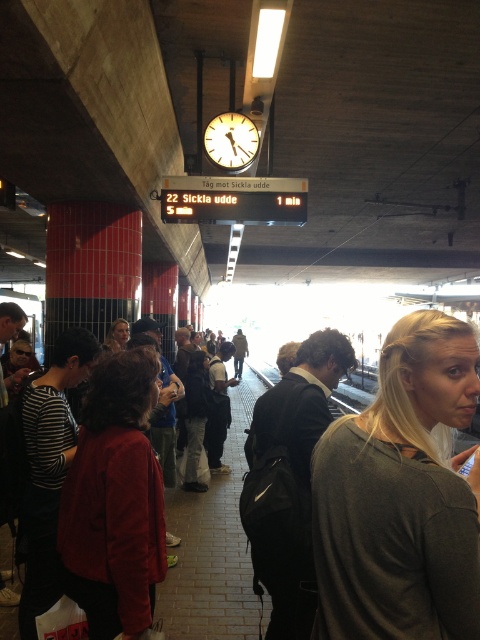
Does gray matte shirt at center have a greater width compared to dark gray backpack at center?

No.

Image resolution: width=480 pixels, height=640 pixels. Find the location of `gray matte shirt at center`. gray matte shirt at center is located at coordinates (400, 497).

Is velvet red jacket at center positioned at the back of dark red sweater at center?

No, velvet red jacket at center is in front of dark red sweater at center.

Does velvet red jacket at center lie in front of dark red sweater at center?

Yes, velvet red jacket at center is in front of dark red sweater at center.

The width and height of the screenshot is (480, 640). What are the coordinates of `velvet red jacket at center` in the screenshot? It's located at (115, 500).

Does gray matte shirt at center appear over velvet red jacket at center?

Yes.

Which is above, gray matte shirt at center or velvet red jacket at center?

gray matte shirt at center is above.

Locate an element on the screen. gray matte shirt at center is located at coordinates (400, 497).

The image size is (480, 640). I want to click on gray matte shirt at center, so [x=400, y=497].